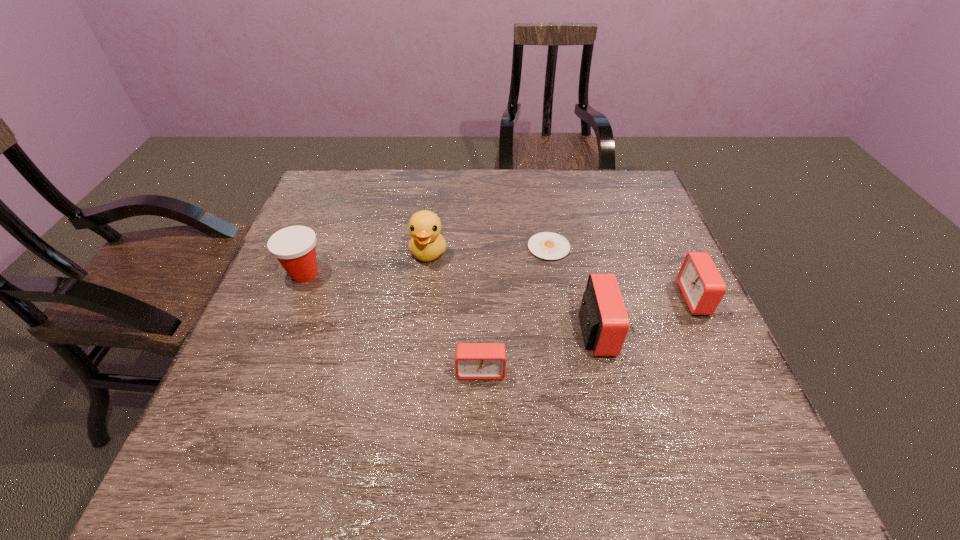
Where is `free space located 0.120m on the front-facing side of the rightmost alarm clock`? Image resolution: width=960 pixels, height=540 pixels. free space located 0.120m on the front-facing side of the rightmost alarm clock is located at coordinates (633, 298).

Locate an element on the screen. The height and width of the screenshot is (540, 960). vacant space located 0.120m on the front-facing side of the rightmost alarm clock is located at coordinates (633, 298).

In order to click on vacant space located 0.350m on the front-facing side of the rightmost alarm clock in this screenshot , I will do `click(538, 298)`.

This screenshot has width=960, height=540. I want to click on free spot located on the face of the duck, so click(x=424, y=287).

Locate an element on the screen. free spot located 0.100m on the right of the shortest object is located at coordinates (607, 247).

Identify the location of free region located 0.080m on the right of the leftmost object. (357, 274).

Locate an element on the screen. This screenshot has height=540, width=960. object located in the left edge section of the desktop is located at coordinates (294, 247).

Where is `object present at the right edge`? object present at the right edge is located at coordinates (702, 286).

In the image, there is a desktop. Find the location of `free region at the far edge`. free region at the far edge is located at coordinates (417, 184).

The width and height of the screenshot is (960, 540). Find the location of `vacant space at the near edge of the desktop`. vacant space at the near edge of the desktop is located at coordinates (386, 390).